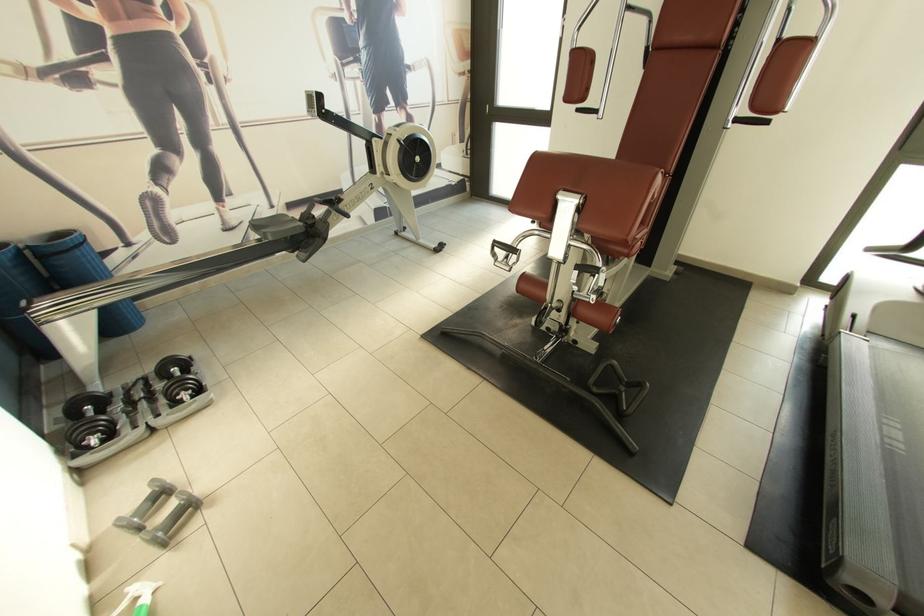
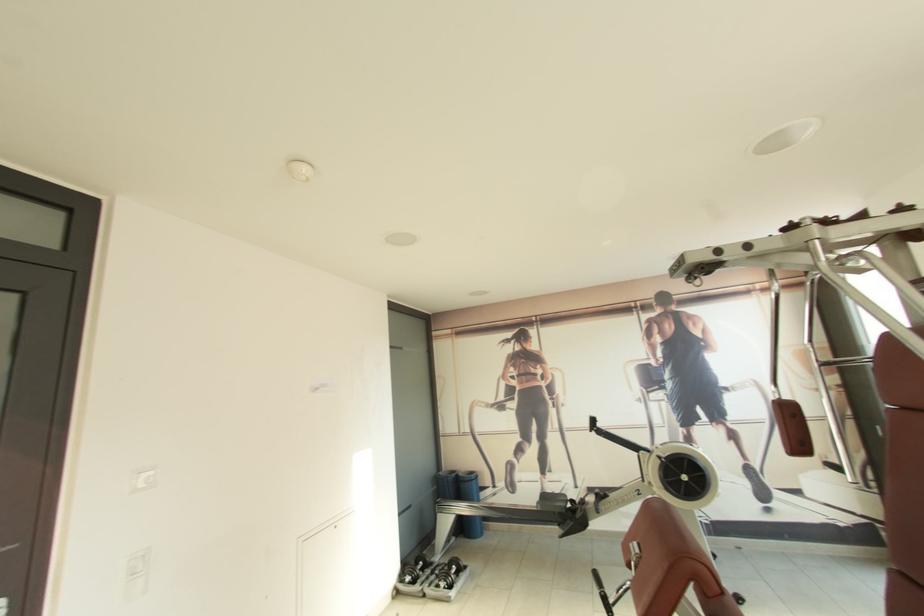
The point at (x=149, y=407) is marked in the first image. Where is the corresponding point in the second image?

(436, 578)